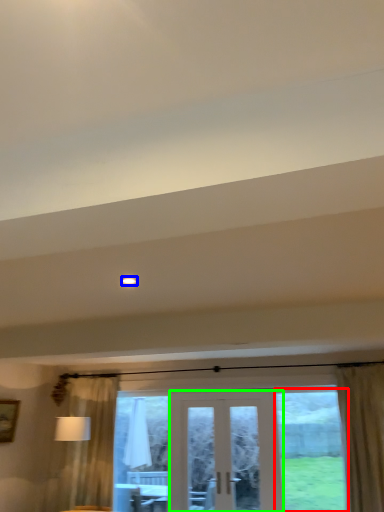
Question: Based on their relative distances, which object is nearer to window (highlighted by a red box)? Choose from light (highlighted by a blue box) and door (highlighted by a green box).

Choices:
 (A) light
 (B) door

Answer: (B)